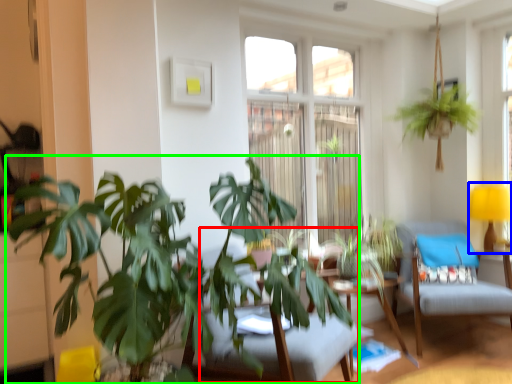
Question: Considering the real-world distances, which object is closest to swivel chair (highlighted by a red box)? table lamp (highlighted by a blue box) or houseplant (highlighted by a green box).

Choices:
 (A) table lamp
 (B) houseplant

Answer: (B)